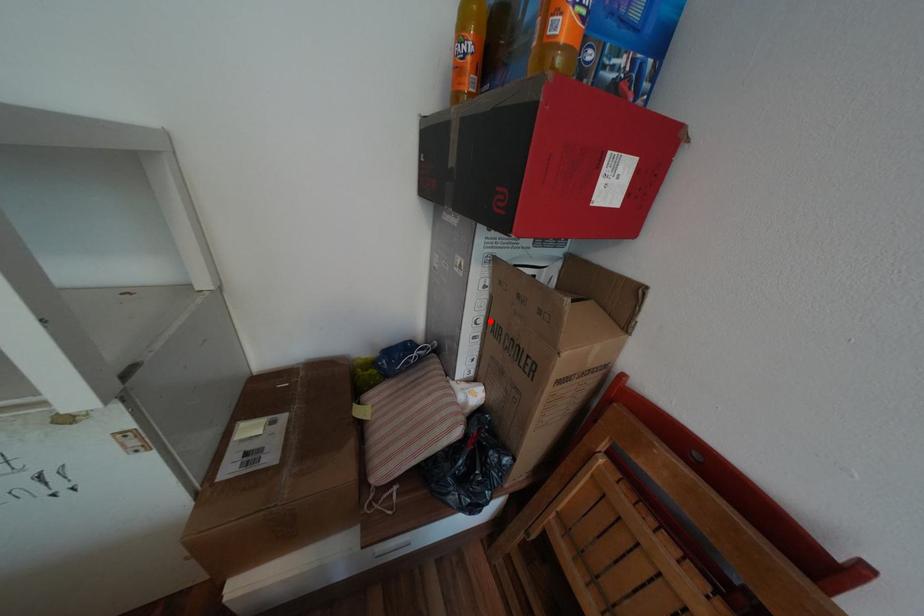
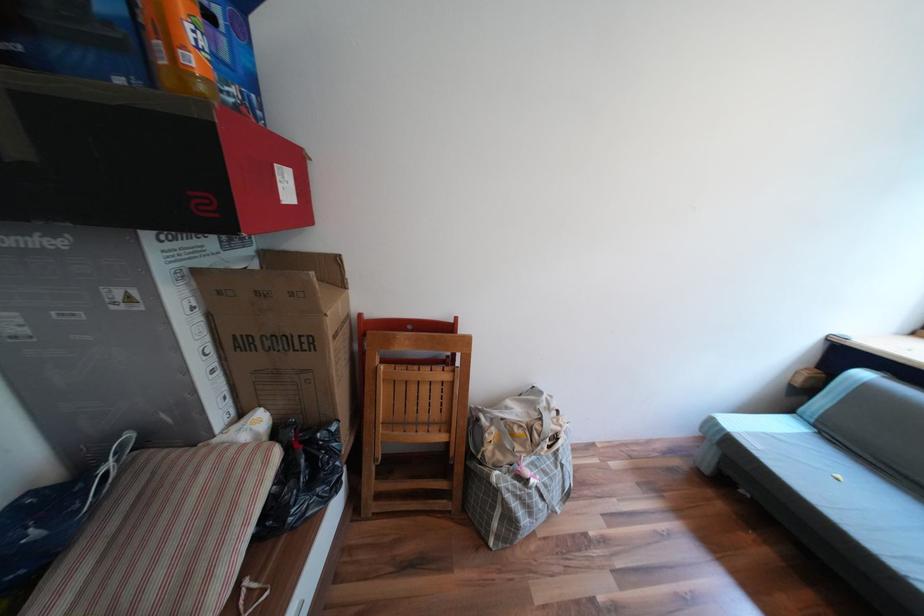
Question: I am providing you with two images of the same scene from different viewpoints. A red point is marked on the first image. At the location where the point appears in image 1, is it still visible in image 2?

Choices:
 (A) Yes
 (B) No

Answer: (A)